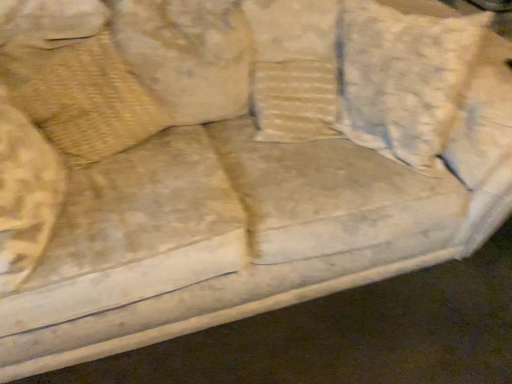
Identify the location of beige textured pillow at upper left, which is the first pillow in left-to-right order. (90, 103).

Describe the element at coordinates (90, 103) in the screenshot. I see `beige textured pillow at upper left, the second pillow in the right-to-left sequence` at that location.

You are a GUI agent. You are given a task and a screenshot of the screen. Output one action in this format:
    pyautogui.click(x=<x>, y=<y>)
    Task: Click on the washed cotton pillow at center, which appears as the first pillow when viewed from the right
    The image size is (512, 384).
    Given the screenshot: What is the action you would take?
    pyautogui.click(x=404, y=78)

Describe the element at coordinates (404, 78) in the screenshot. I see `washed cotton pillow at center, the second pillow positioned from the left` at that location.

Find the location of a particular element. The image size is (512, 384). beige textured pillow at upper left, which is the first pillow in left-to-right order is located at coordinates (90, 103).

Between washed cotton pillow at center, the second pillow positioned from the left, and beige textured pillow at upper left, which is the first pillow in left-to-right order, which one appears on the right side from the viewer's perspective?

washed cotton pillow at center, the second pillow positioned from the left, is more to the right.

Does washed cotton pillow at center, the second pillow positioned from the left, lie behind beige textured pillow at upper left, which is the first pillow in left-to-right order?

No, the depth of washed cotton pillow at center, the second pillow positioned from the left, is less than that of beige textured pillow at upper left, which is the first pillow in left-to-right order.

Does point (431, 131) appear closer or farther from the camera than point (92, 138)?

Point (431, 131) is positioned closer to the camera compared to point (92, 138).

From the image's perspective, is washed cotton pillow at center, the second pillow positioned from the left, under beige textured pillow at upper left, the second pillow in the right-to-left sequence?

No, from the image's perspective, washed cotton pillow at center, the second pillow positioned from the left, is not below beige textured pillow at upper left, the second pillow in the right-to-left sequence.

From a real-world perspective, which object rests below the other?

beige textured pillow at upper left, the second pillow in the right-to-left sequence, is physically lower.

Between washed cotton pillow at center, the second pillow positioned from the left, and beige textured pillow at upper left, the second pillow in the right-to-left sequence, which one has smaller width?

With smaller width is beige textured pillow at upper left, the second pillow in the right-to-left sequence.

Is washed cotton pillow at center, the second pillow positioned from the left, shorter than beige textured pillow at upper left, the second pillow in the right-to-left sequence?

No.

Is washed cotton pillow at center, which appears as the first pillow when viewed from the right, smaller than beige textured pillow at upper left, which is the first pillow in left-to-right order?

No, washed cotton pillow at center, which appears as the first pillow when viewed from the right, is not smaller than beige textured pillow at upper left, which is the first pillow in left-to-right order.

Is beige textured pillow at upper left, the second pillow in the right-to-left sequence, located within washed cotton pillow at center, the second pillow positioned from the left?

No.

Is there a large distance between washed cotton pillow at center, which appears as the first pillow when viewed from the right, and beige textured pillow at upper left, which is the first pillow in left-to-right order?

washed cotton pillow at center, which appears as the first pillow when viewed from the right, is actually quite close to beige textured pillow at upper left, which is the first pillow in left-to-right order.

Looking at this image, is washed cotton pillow at center, the second pillow positioned from the left, turned away from beige textured pillow at upper left, the second pillow in the right-to-left sequence?

No, beige textured pillow at upper left, the second pillow in the right-to-left sequence, is not at the back of washed cotton pillow at center, the second pillow positioned from the left.

Could you measure the distance between washed cotton pillow at center, the second pillow positioned from the left, and beige textured pillow at upper left, the second pillow in the right-to-left sequence?

A distance of 33.55 inches exists between washed cotton pillow at center, the second pillow positioned from the left, and beige textured pillow at upper left, the second pillow in the right-to-left sequence.

Where is `pillow on the right of beige textured pillow at upper left, the second pillow in the right-to-left sequence`? This screenshot has width=512, height=384. pillow on the right of beige textured pillow at upper left, the second pillow in the right-to-left sequence is located at coordinates (404, 78).

Which is more to the left, beige textured pillow at upper left, the second pillow in the right-to-left sequence, or washed cotton pillow at center, which appears as the first pillow when viewed from the right?

beige textured pillow at upper left, the second pillow in the right-to-left sequence, is more to the left.

Does beige textured pillow at upper left, which is the first pillow in left-to-right order, come behind washed cotton pillow at center, which appears as the first pillow when viewed from the right?

Yes, it is.

Considering the points (91, 49) and (416, 97), which point is in front, point (91, 49) or point (416, 97)?

The point (91, 49) is in front.

From the image's perspective, which one is positioned lower, beige textured pillow at upper left, which is the first pillow in left-to-right order, or washed cotton pillow at center, which appears as the first pillow when viewed from the right?

beige textured pillow at upper left, which is the first pillow in left-to-right order, appears lower in the image.

From a real-world perspective, which is physically below, beige textured pillow at upper left, which is the first pillow in left-to-right order, or washed cotton pillow at center, the second pillow positioned from the left?

beige textured pillow at upper left, which is the first pillow in left-to-right order.

Which of these two, beige textured pillow at upper left, the second pillow in the right-to-left sequence, or washed cotton pillow at center, which appears as the first pillow when viewed from the right, is wider?

With larger width is washed cotton pillow at center, which appears as the first pillow when viewed from the right.

Considering the relative sizes of beige textured pillow at upper left, the second pillow in the right-to-left sequence, and washed cotton pillow at center, the second pillow positioned from the left, in the image provided, is beige textured pillow at upper left, the second pillow in the right-to-left sequence, taller than washed cotton pillow at center, the second pillow positioned from the left,?

No.

Considering the sizes of objects beige textured pillow at upper left, which is the first pillow in left-to-right order, and washed cotton pillow at center, which appears as the first pillow when viewed from the right, in the image provided, who is bigger, beige textured pillow at upper left, which is the first pillow in left-to-right order, or washed cotton pillow at center, which appears as the first pillow when viewed from the right,?

With larger size is washed cotton pillow at center, which appears as the first pillow when viewed from the right.

Consider the image. Is beige textured pillow at upper left, the second pillow in the right-to-left sequence, situated inside washed cotton pillow at center, the second pillow positioned from the left, or outside?

beige textured pillow at upper left, the second pillow in the right-to-left sequence, is outside washed cotton pillow at center, the second pillow positioned from the left.

Are beige textured pillow at upper left, the second pillow in the right-to-left sequence, and washed cotton pillow at center, the second pillow positioned from the left, located far from each other?

No, there isn't a large distance between beige textured pillow at upper left, the second pillow in the right-to-left sequence, and washed cotton pillow at center, the second pillow positioned from the left.

Is beige textured pillow at upper left, the second pillow in the right-to-left sequence, positioned with its back to washed cotton pillow at center, the second pillow positioned from the left?

No.

How different are the orientations of beige textured pillow at upper left, the second pillow in the right-to-left sequence, and washed cotton pillow at center, the second pillow positioned from the left, in degrees?

beige textured pillow at upper left, the second pillow in the right-to-left sequence, and washed cotton pillow at center, the second pillow positioned from the left, are facing 92.2 degrees away from each other.

How far apart are beige textured pillow at upper left, the second pillow in the right-to-left sequence, and washed cotton pillow at center, the second pillow positioned from the left?

beige textured pillow at upper left, the second pillow in the right-to-left sequence, is 33.55 inches from washed cotton pillow at center, the second pillow positioned from the left.

Where is `pillow behind the washed cotton pillow at center, which appears as the first pillow when viewed from the right`? The width and height of the screenshot is (512, 384). pillow behind the washed cotton pillow at center, which appears as the first pillow when viewed from the right is located at coordinates (90, 103).

You are a GUI agent. You are given a task and a screenshot of the screen. Output one action in this format:
    pyautogui.click(x=<x>, y=<y>)
    Task: Click on the pillow on the right side of beige textured pillow at upper left, which is the first pillow in left-to-right order
    The height and width of the screenshot is (384, 512).
    Given the screenshot: What is the action you would take?
    pyautogui.click(x=404, y=78)

Identify the location of pillow on the left of washed cotton pillow at center, the second pillow positioned from the left. (90, 103).